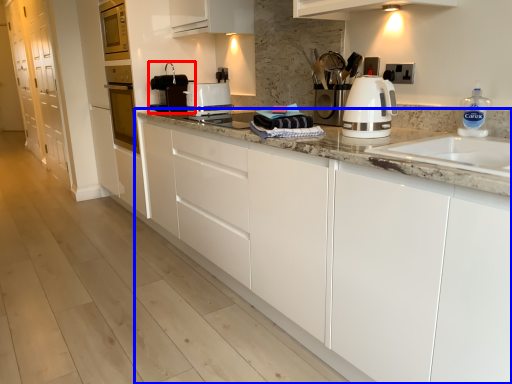
Question: Which object appears closest to the camera in this image, home appliance (highlighted by a red box) or cabinetry (highlighted by a blue box)?

Choices:
 (A) home appliance
 (B) cabinetry

Answer: (B)